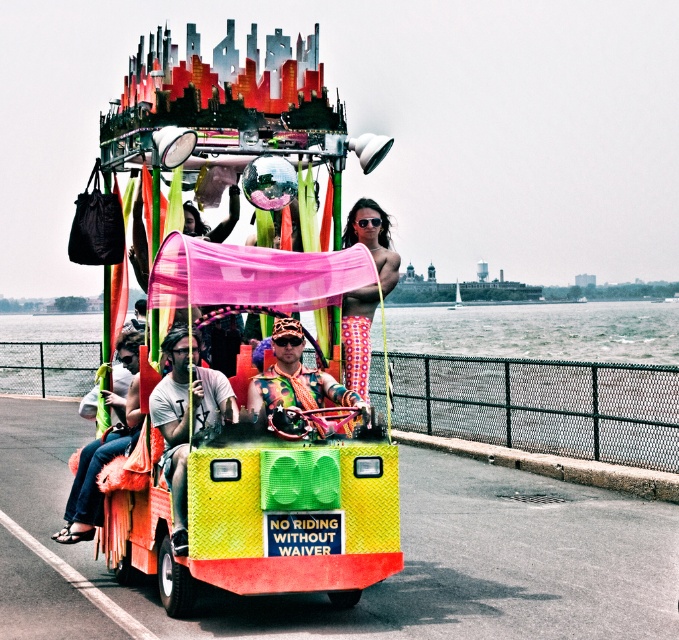
Which is in front, point (352, 342) or point (274, 392)?

Positioned in front is point (274, 392).

Is point (344, 346) farther from viewer compared to point (276, 365)?

Yes, it is behind point (276, 365).

Locate an element on the screen. The image size is (679, 640). multicolored fabric pants at center is located at coordinates (356, 337).

Which is more to the left, translucent plastic water at lower center or denim pants at lower left?

Positioned to the left is translucent plastic water at lower center.

Is translucent plastic water at lower center wider than denim pants at lower left?

Indeed, translucent plastic water at lower center has a greater width compared to denim pants at lower left.

Does point (509, 316) come behind point (130, 413)?

That is True.

Identify the location of translucent plastic water at lower center. This screenshot has width=679, height=640. (543, 376).

Who is higher up, matte white t-shirt at center or multicolored fabric pants at center?

multicolored fabric pants at center is higher up.

Can you confirm if matte white t-shirt at center is positioned above multicolored fabric pants at center?

Actually, matte white t-shirt at center is below multicolored fabric pants at center.

Where is `matte white t-shirt at center`? matte white t-shirt at center is located at coordinates (175, 428).

In order to click on matte white t-shirt at center in this screenshot , I will do `click(175, 428)`.